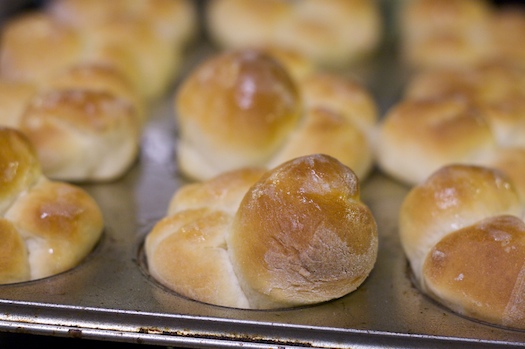
This screenshot has width=525, height=349. What are the coordinates of `circle cups` in the screenshot? It's located at (80, 265), (109, 177), (155, 90), (143, 259), (245, 27), (416, 61), (404, 93), (406, 187), (422, 295).